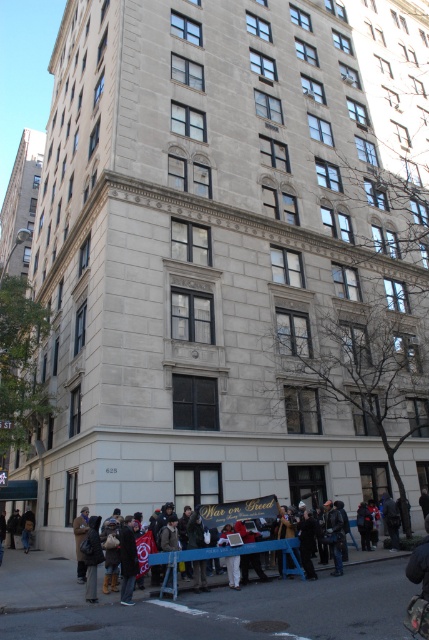
You are a photographer trying to capture a clear shot of the multi story building. You notice two people in the foreground wearing a white cotton shirt at lower center and a dark brown leather jacket at lower left. Which clothing item would block your view of the building more if they are standing in the same spot?

The white cotton shirt at lower center would block the view more because it has a larger size compared to the dark brown leather jacket at lower left.

You are a photographer standing at the back of the crowd. You want to take a photo of the white cotton shirt at lower center and the dark brown leather jacket at lower left together in the frame. Based on their current positions, can you capture both in a single shot without moving?

The distance between the white cotton shirt at lower center and the dark brown leather jacket at lower left is 26.41 meters. Since they are positioned far apart, it might be challenging to capture both in a single frame without zooming out significantly or moving closer to the scene.